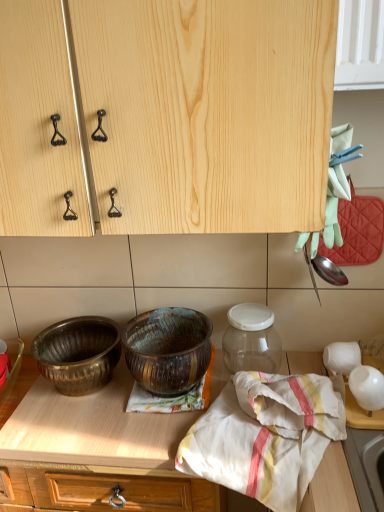
Question: Would you say rusty metallic bowl at center, the 1th bowl in the right-to-left sequence, is to the left or to the right of polished brass bowl at lower left, which is the second bowl from right to left, in the picture?

Choices:
 (A) right
 (B) left

Answer: (A)

Question: In terms of height, does rusty metallic bowl at center, the 1th bowl in the right-to-left sequence, look taller or shorter compared to polished brass bowl at lower left, which is counted as the first bowl, starting from the left?

Choices:
 (A) short
 (B) tall

Answer: (B)

Question: Estimate the real-world distances between objects in this image. Which object is closer to the white glossy vase at right?

Choices:
 (A) wooden at center
 (B) polished brass bowl at lower left, which is the second bowl from right to left
 (C) rusty metallic bowl at center, placed as the 2th bowl when sorted from left to right
 (D) transparent glass jar at center
 (E) white cotton cloth at center

Answer: (E)

Question: Which of these objects is positioned closest to the white cotton cloth at center?

Choices:
 (A) wooden at center
 (B) polished brass bowl at lower left, which is counted as the first bowl, starting from the left
 (C) natural wood cabinet at upper center
 (D) transparent glass jar at center
 (E) white glossy vase at right

Answer: (A)